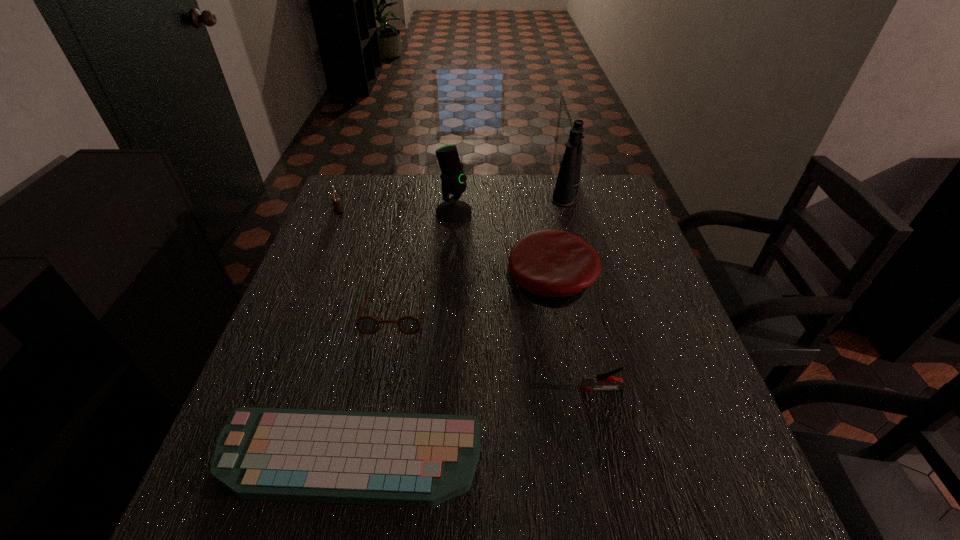
I want to click on free area in between the spectacles and the cap, so click(x=472, y=300).

Image resolution: width=960 pixels, height=540 pixels. I want to click on vacant space in between the microphone and the spectacles, so click(x=424, y=262).

Image resolution: width=960 pixels, height=540 pixels. I want to click on empty space between the nearest object and the second shortest object, so click(372, 386).

Choose which object is the third nearest neighbor to the second nearest object. Please provide its 2D coordinates. Your answer should be formatted as a tuple, i.e. [(x, y)], where the tuple contains the x and y coordinates of a point satisfying the conditions above.

[(368, 325)]

Choose which object is the sixth nearest neighbor to the cap. Please provide its 2D coordinates. Your answer should be formatted as a tuple, i.e. [(x, y)], where the tuple contains the x and y coordinates of a point satisfying the conditions above.

[(338, 209)]

Where is `free space that satisfies the following two spatial constraints: 1. on the front side of the microphone; 2. on the left side of the padlock`? Image resolution: width=960 pixels, height=540 pixels. free space that satisfies the following two spatial constraints: 1. on the front side of the microphone; 2. on the left side of the padlock is located at coordinates (338, 212).